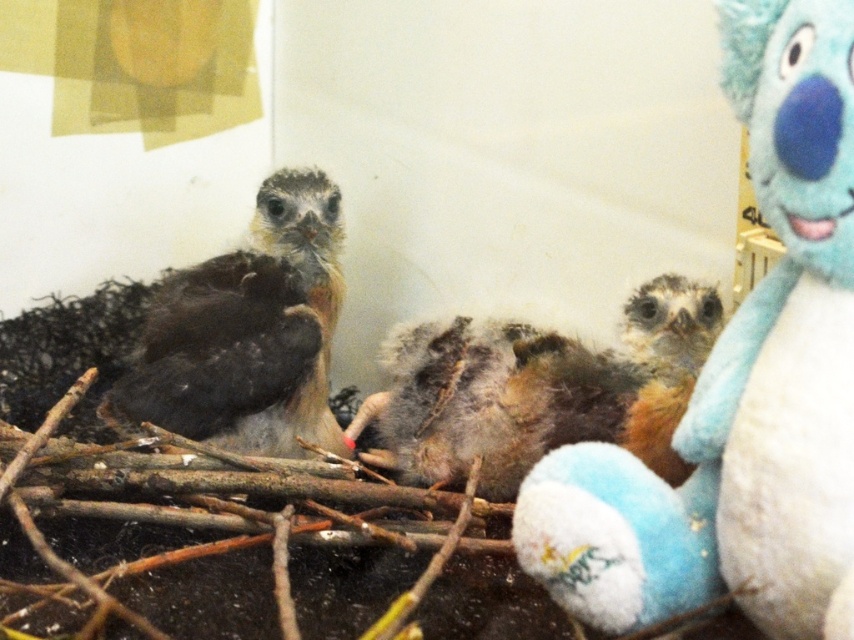
You are a caretaker in a bird sanctuary and need to place a new feeding tray for the baby birds. The tray must be placed exactly at the point specified by the coordinates point (x=740, y=381). Where should you place the feeding tray?

The point (x=740, y=381) corresponds to the fluffy blue plush at right, so you should place the feeding tray at the fluffy blue plush at right.

You are a curious baby bird in the nest. You want to look at the fluffy blue plush at right and the brown fluffy bird at left. Which one is closer to you from your position in the nest?

The fluffy blue plush at right is closer because it is in front of the brown fluffy bird at left from your perspective in the nest.

You are a young bird in the nest. You want to fly to the fluffy blue plush at right. Which direction should you fly first to reach it without going around the fuzzy brown bird at center?

The fluffy blue plush at right is in front of the fuzzy brown bird at center, so you should fly forward towards the fluffy blue plush at right to reach it without going around the fuzzy brown bird at center.